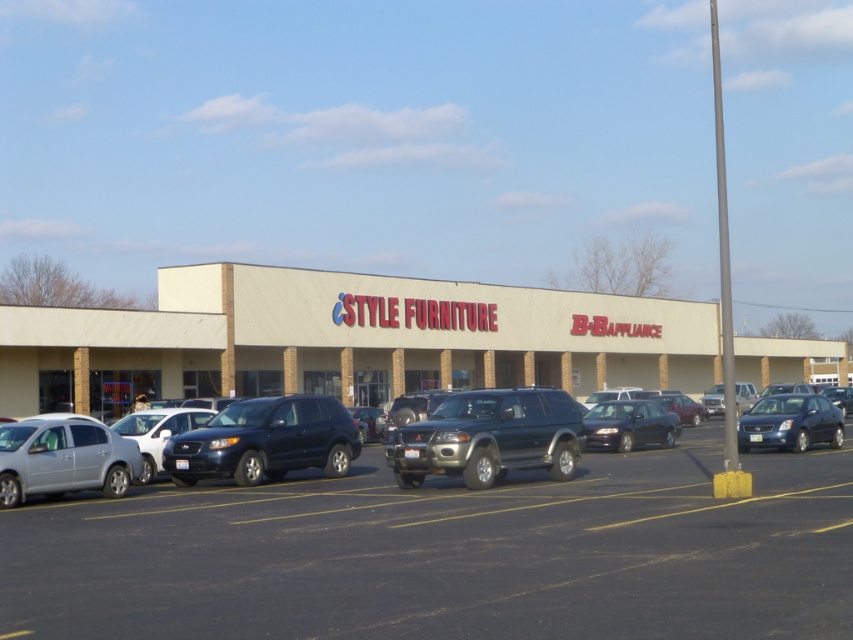
Based on the photo, you are a delivery driver who needs to park your truck in the dark gray asphalt parking lot at center. The satin blue sedan at right is already parked there. Can you still fit your truck into the parking space without overlapping the sedan?

The dark gray asphalt parking lot at center has a larger size compared to the satin blue sedan at right, so there is enough space to park your truck without overlapping the sedan.

You are a delivery driver who needs to park your truck in the parking lot. You see a shiny dark blue suv at center and a satin blue sedan at right. Which vehicle has a wider body to accommodate your truck?

The satin blue sedan at right has a wider body compared to the shiny dark blue suv at center, so it might not be suitable for parking your truck. Look for another space.

You are standing at the entrance of the iSTYLE FURNITURE store and want to go to the parking spot marked by point (807, 424). There is an obstacle at point (332, 451). Can you walk around the obstacle to reach your destination?

Point (332, 451) is in front of point (807, 424), so you cannot walk around the obstacle at point (332, 451) to reach your destination because it is blocking the path.